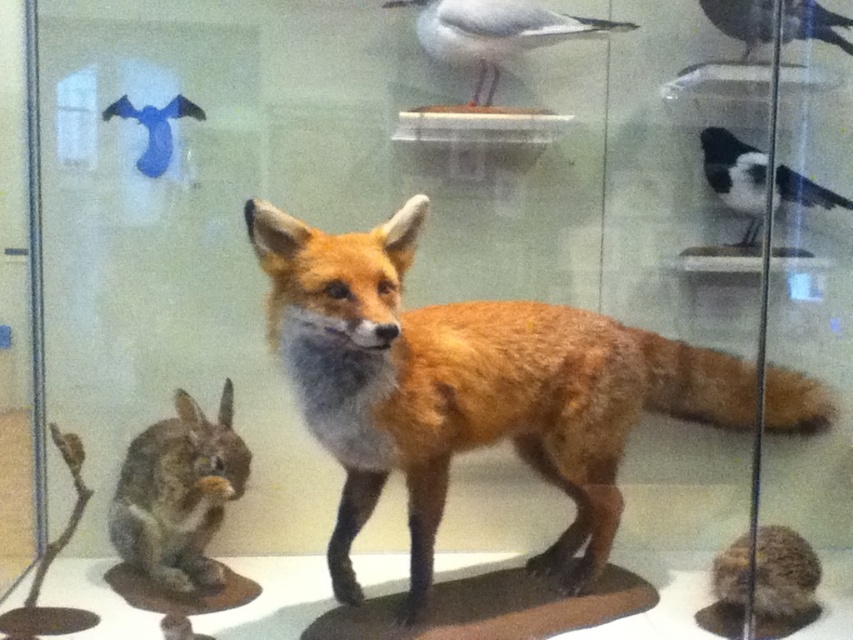
You are a museum visitor who wants to take a photo of the black glossy bird at upper right without the fuzzy brown fur at lower left appearing in the frame. Is this possible given their sizes?

The fuzzy brown fur at lower left is larger in size than the black glossy bird at upper right. Therefore, it might be challenging to frame the black glossy bird at upper right without including the fuzzy brown fur at lower left due to its larger size.

You are a visitor looking at the display case in the museum. You notice two points marked in the scene. Which point is closer to you, point at coordinate (712,180) or point at coordinate (819,4)?

Point at coordinate (712,180) is closer to you than point at coordinate (819,4) because it is further to the camera than the other point.